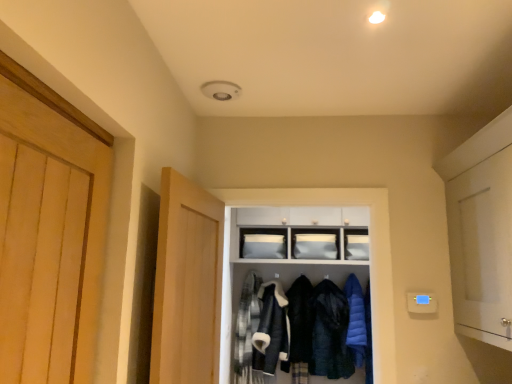
I want to click on dark blue quilted jacket at center, which ranks as the 2th clothing in right-to-left order, so click(330, 333).

Measure the distance between point (261, 215) and camera.

The depth of point (261, 215) is 3.84 meters.

What do you see at coordinates (300, 329) in the screenshot? The width and height of the screenshot is (512, 384). I see `dark blue wool coat at center, the 3th clothing in the right-to-left sequence` at bounding box center [300, 329].

Find the location of a particular element. The image size is (512, 384). dark blue wool coat at center, which is the third clothing from left to right is located at coordinates (300, 329).

Measure the distance between light wood door at center, marked as the 1th door in a left-to-right arrangement, and camera.

light wood door at center, marked as the 1th door in a left-to-right arrangement, and camera are 1.45 meters apart from each other.

What do you see at coordinates (482, 249) in the screenshot? This screenshot has height=384, width=512. I see `white matte cabinet at right, the 2th door viewed from the left` at bounding box center [482, 249].

Image resolution: width=512 pixels, height=384 pixels. I want to click on blue down jacket at center, which is the 1th clothing from right to left, so click(x=356, y=320).

Identify the location of dark blue quilted jacket at center, which ranks as the 4th clothing in left-to-right order. (330, 333).

Would you say light wood door at center, marked as the 1th door in a left-to-right arrangement, contains blue down jacket at center, which is the 1th clothing from right to left?

No.

From the image's perspective, which is above, light wood door at center, the second door viewed from the right, or blue down jacket at center, the 5th clothing in the left-to-right sequence?

light wood door at center, the second door viewed from the right, appears higher in the image.

Considering the relative positions of light wood door at center, the second door viewed from the right, and blue down jacket at center, the 5th clothing in the left-to-right sequence, in the image provided, is light wood door at center, the second door viewed from the right, in front of blue down jacket at center, the 5th clothing in the left-to-right sequence,?

Yes, light wood door at center, the second door viewed from the right, is in front of blue down jacket at center, the 5th clothing in the left-to-right sequence.

Does blue down jacket at center, the 5th clothing in the left-to-right sequence, turn towards white fur-lined jacket at center, the fourth clothing positioned from the right?

No, blue down jacket at center, the 5th clothing in the left-to-right sequence, is not oriented towards white fur-lined jacket at center, the fourth clothing positioned from the right.

Is blue down jacket at center, which is the 1th clothing from right to left, taller than white fur-lined jacket at center, the fourth clothing positioned from the right?

In fact, blue down jacket at center, which is the 1th clothing from right to left, may be shorter than white fur-lined jacket at center, the fourth clothing positioned from the right.

Which is less distant, (348, 286) or (261, 370)?

The point (261, 370) is closer to the camera.

Is point (360, 352) farther from camera compared to point (326, 291)?

No, it is in front of (326, 291).

Is blue down jacket at center, the 5th clothing in the left-to-right sequence, oriented away from dark blue quilted jacket at center, which ranks as the 4th clothing in left-to-right order?

No, blue down jacket at center, the 5th clothing in the left-to-right sequence,'s orientation is not away from dark blue quilted jacket at center, which ranks as the 4th clothing in left-to-right order.

Is blue down jacket at center, which is the 1th clothing from right to left, to the left of dark blue quilted jacket at center, which ranks as the 2th clothing in right-to-left order, from the viewer's perspective?

In fact, blue down jacket at center, which is the 1th clothing from right to left, is to the right of dark blue quilted jacket at center, which ranks as the 2th clothing in right-to-left order.

Is blue down jacket at center, which is the 1th clothing from right to left, smaller than dark blue quilted jacket at center, which ranks as the 2th clothing in right-to-left order?

Correct, blue down jacket at center, which is the 1th clothing from right to left, occupies less space than dark blue quilted jacket at center, which ranks as the 2th clothing in right-to-left order.

Is white fur-lined jacket at center, arranged as the 2th clothing when viewed from the left, facing away from white matte cabinet at center, the 2th cabinetry when ordered from top to bottom?

Yes, white fur-lined jacket at center, arranged as the 2th clothing when viewed from the left, is facing away from white matte cabinet at center, the 2th cabinetry when ordered from top to bottom.

From a real-world perspective, which object rests below the other?

In real-world perspective, white fur-lined jacket at center, the fourth clothing positioned from the right, is lower.

Does white fur-lined jacket at center, arranged as the 2th clothing when viewed from the left, come behind white matte cabinet at center, the 2th cabinetry when ordered from top to bottom?

Yes, white fur-lined jacket at center, arranged as the 2th clothing when viewed from the left, is further from the camera.

Considering the relative sizes of dark blue quilted jacket at center, which ranks as the 2th clothing in right-to-left order, and blue down jacket at center, the 5th clothing in the left-to-right sequence, in the image provided, is dark blue quilted jacket at center, which ranks as the 2th clothing in right-to-left order, thinner than blue down jacket at center, the 5th clothing in the left-to-right sequence,?

No, dark blue quilted jacket at center, which ranks as the 2th clothing in right-to-left order, is not thinner than blue down jacket at center, the 5th clothing in the left-to-right sequence.

From the picture: Is dark blue quilted jacket at center, which ranks as the 2th clothing in right-to-left order, taller or shorter than blue down jacket at center, which is the 1th clothing from right to left?

Considering their sizes, dark blue quilted jacket at center, which ranks as the 2th clothing in right-to-left order, has more height than blue down jacket at center, which is the 1th clothing from right to left.

Could you measure the distance between dark blue quilted jacket at center, which ranks as the 4th clothing in left-to-right order, and blue down jacket at center, which is the 1th clothing from right to left?

dark blue quilted jacket at center, which ranks as the 4th clothing in left-to-right order, and blue down jacket at center, which is the 1th clothing from right to left, are 5.95 inches apart.

Does dark blue quilted jacket at center, which ranks as the 2th clothing in right-to-left order, turn towards blue down jacket at center, the 5th clothing in the left-to-right sequence?

No.

Is light wood door at center, the second door viewed from the right, oriented away from white fur-lined jacket at center, the fourth clothing positioned from the right?

light wood door at center, the second door viewed from the right, is not turned away from white fur-lined jacket at center, the fourth clothing positioned from the right.

Which object is wider, light wood door at center, marked as the 1th door in a left-to-right arrangement, or white fur-lined jacket at center, the fourth clothing positioned from the right?

white fur-lined jacket at center, the fourth clothing positioned from the right.

Is light wood door at center, the second door viewed from the right, far from white fur-lined jacket at center, the fourth clothing positioned from the right?

Absolutely, light wood door at center, the second door viewed from the right, is distant from white fur-lined jacket at center, the fourth clothing positioned from the right.

Considering the sizes of light wood door at center, marked as the 1th door in a left-to-right arrangement, and white fur-lined jacket at center, the fourth clothing positioned from the right, in the image, is light wood door at center, marked as the 1th door in a left-to-right arrangement, taller or shorter than white fur-lined jacket at center, the fourth clothing positioned from the right,?

light wood door at center, marked as the 1th door in a left-to-right arrangement, is taller than white fur-lined jacket at center, the fourth clothing positioned from the right.

Is white matte cabinet at center, the 2th cabinetry when ordered from top to bottom, at the right side of dark blue wool coat at center, which is the third clothing from left to right?

Yes.

Are white matte cabinet at center, the 2th cabinetry when ordered from top to bottom, and dark blue wool coat at center, which is the third clothing from left to right, located far from each other?

Actually, white matte cabinet at center, the 2th cabinetry when ordered from top to bottom, and dark blue wool coat at center, which is the third clothing from left to right, are a little close together.

Between point (281, 381) and point (303, 306), which one is positioned behind?

Point (303, 306)

Which of these two, white matte cabinet at center, arranged as the first cabinetry when ordered from the bottom, or dark blue wool coat at center, which is the third clothing from left to right, is thinner?

With smaller width is dark blue wool coat at center, which is the third clothing from left to right.

Image resolution: width=512 pixels, height=384 pixels. I want to click on door that is on the left side of blue down jacket at center, the 5th clothing in the left-to-right sequence, so click(187, 284).

At what (x,y) coordinates should I click in order to perform the action: click on clothing that is in front of the blue down jacket at center, which is the 1th clothing from right to left. Please return your answer as a coordinate pair (x, y). This screenshot has height=384, width=512. Looking at the image, I should click on (271, 329).

Considering their positions, is plaid fabric shirt at center, the 1th clothing viewed from the left, positioned further to dark blue wool coat at center, which is the third clothing from left to right, than white matte cabinet at center, the 2th cabinetry when ordered from top to bottom?

white matte cabinet at center, the 2th cabinetry when ordered from top to bottom.

Which object lies further to the anchor point blue down jacket at center, which is the 1th clothing from right to left, matte white cabinet at center, the 2th cabinetry in the bottom-to-top sequence, or plaid fabric shirt at center, the 5th clothing when ordered from right to left?

Based on the image, plaid fabric shirt at center, the 5th clothing when ordered from right to left, appears to be further to blue down jacket at center, which is the 1th clothing from right to left.

Which object lies further to the anchor point plaid fabric shirt at center, the 5th clothing when ordered from right to left, white matte cabinet at center, the 2th cabinetry when ordered from top to bottom, or white matte cabinet at right, the 2th door viewed from the left?

white matte cabinet at right, the 2th door viewed from the left.

When comparing their distances from light wood door at center, the second door viewed from the right, does dark blue quilted jacket at center, which ranks as the 4th clothing in left-to-right order, or blue down jacket at center, the 5th clothing in the left-to-right sequence, seem further?

blue down jacket at center, the 5th clothing in the left-to-right sequence, is further to light wood door at center, the second door viewed from the right.

Looking at the image, which one is located closer to blue down jacket at center, which is the 1th clothing from right to left, plaid fabric shirt at center, the 1th clothing viewed from the left, or white matte cabinet at right, the 2th door viewed from the left?

The object closer to blue down jacket at center, which is the 1th clothing from right to left, is plaid fabric shirt at center, the 1th clothing viewed from the left.

When comparing their distances from dark blue wool coat at center, the 3th clothing in the right-to-left sequence, does white fur-lined jacket at center, the fourth clothing positioned from the right, or white matte cabinet at center, the 2th cabinetry when ordered from top to bottom, seem further?

white matte cabinet at center, the 2th cabinetry when ordered from top to bottom, lies further to dark blue wool coat at center, the 3th clothing in the right-to-left sequence, than the other object.

Which object lies nearer to the anchor point plaid fabric shirt at center, the 1th clothing viewed from the left, dark blue wool coat at center, which is the third clothing from left to right, or matte white cabinet at center, the first cabinetry positioned from the top?

Based on the image, dark blue wool coat at center, which is the third clothing from left to right, appears to be nearer to plaid fabric shirt at center, the 1th clothing viewed from the left.

Based on their spatial positions, is white matte cabinet at right, which is the first door in right-to-left order, or white matte cabinet at center, arranged as the first cabinetry when ordered from the bottom, closer to matte white cabinet at center, the first cabinetry positioned from the top?

Among the two, white matte cabinet at center, arranged as the first cabinetry when ordered from the bottom, is located nearer to matte white cabinet at center, the first cabinetry positioned from the top.

Find the location of a particular element. The width and height of the screenshot is (512, 384). door positioned between white matte cabinet at right, the 2th door viewed from the left, and blue down jacket at center, the 5th clothing in the left-to-right sequence, from near to far is located at coordinates pos(187,284).

You are a GUI agent. You are given a task and a screenshot of the screen. Output one action in this format:
    pyautogui.click(x=<x>, y=<y>)
    Task: Click on the clothing that lies between matte white cabinet at center, the 2th cabinetry in the bottom-to-top sequence, and white fur-lined jacket at center, arranged as the 2th clothing when viewed from the left, from top to bottom
    This screenshot has width=512, height=384.
    Given the screenshot: What is the action you would take?
    pyautogui.click(x=356, y=320)

The image size is (512, 384). Find the location of `cabinetry positioned between light wood door at center, the second door viewed from the right, and dark blue quilted jacket at center, which ranks as the 2th clothing in right-to-left order, from near to far`. cabinetry positioned between light wood door at center, the second door viewed from the right, and dark blue quilted jacket at center, which ranks as the 2th clothing in right-to-left order, from near to far is located at coordinates (293, 251).

Locate an element on the screen. cabinetry between light wood door at center, marked as the 1th door in a left-to-right arrangement, and plaid fabric shirt at center, the 1th clothing viewed from the left, from front to back is located at coordinates (293, 251).